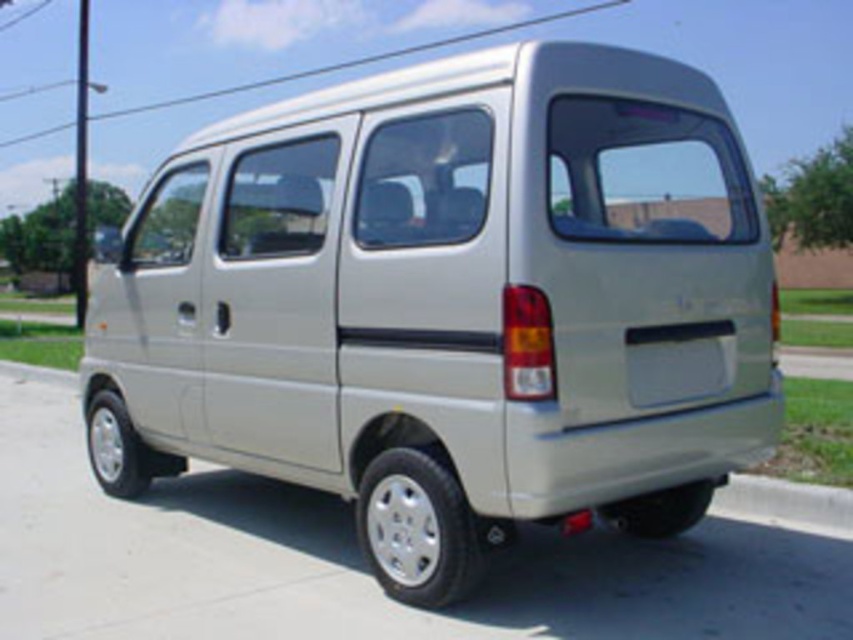
Question: Which of the following is the closest to the observer?

Choices:
 (A) (761, 480)
 (B) (664, 102)

Answer: (B)

Question: Is satin beige van at center to the left of gray concrete curb at lower right from the viewer's perspective?

Choices:
 (A) no
 (B) yes

Answer: (B)

Question: Does satin beige van at center lie in front of gray concrete curb at lower right?

Choices:
 (A) no
 (B) yes

Answer: (B)

Question: Which of the following is the closest to the observer?

Choices:
 (A) gray concrete curb at lower right
 (B) satin beige van at center

Answer: (B)

Question: Does satin beige van at center come behind gray concrete curb at lower right?

Choices:
 (A) yes
 (B) no

Answer: (B)